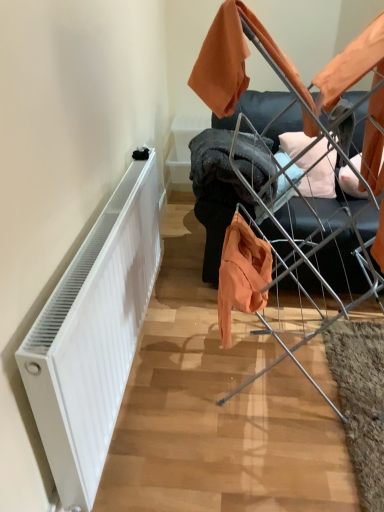
The image size is (384, 512). Identify the location of metallic silver baby carriage at center. (291, 75).

Image resolution: width=384 pixels, height=512 pixels. Identify the location of metal wire drying rack at upper right. (215, 222).

Is metallic silver baby carriage at center beside metal wire drying rack at upper right?

No, metallic silver baby carriage at center is not beside metal wire drying rack at upper right.

Could you tell me if metallic silver baby carriage at center is facing metal wire drying rack at upper right?

Answer: No.

Is metallic silver baby carriage at center inside or outside of metal wire drying rack at upper right?

metallic silver baby carriage at center is outside metal wire drying rack at upper right.

Is point (151, 245) behind point (248, 110)?

No, (151, 245) is closer to viewer.

How far apart are white matte radiator at left and metal wire drying rack at upper right?

A distance of 29.16 inches exists between white matte radiator at left and metal wire drying rack at upper right.

Is white matte radiator at left in contact with metal wire drying rack at upper right?

They are not placed beside each other.

Considering the sizes of objects white matte radiator at left and metal wire drying rack at upper right in the image provided, who is shorter, white matte radiator at left or metal wire drying rack at upper right?

Answer: white matte radiator at left.

Is metallic silver baby carriage at center touching white matte radiator at left?

No, metallic silver baby carriage at center is not with white matte radiator at left.

Is metallic silver baby carriage at center oriented towards white matte radiator at left?

No.

Is point (382, 102) in front of point (151, 182)?

Yes, it is in front of point (151, 182).

From the image's perspective, which is above, metallic silver baby carriage at center or white matte radiator at left?

metallic silver baby carriage at center is shown above in the image.

Based on their positions, is metal wire drying rack at upper right located to the left or right of metallic silver baby carriage at center?

metal wire drying rack at upper right is positioned on metallic silver baby carriage at center's right side.

From a real-world perspective, which is physically above, metal wire drying rack at upper right or metallic silver baby carriage at center?

In real-world perspective, metallic silver baby carriage at center is above.

Considering the positions of objects metal wire drying rack at upper right and metallic silver baby carriage at center in the image provided, who is behind, metal wire drying rack at upper right or metallic silver baby carriage at center?

metal wire drying rack at upper right is more distant.

This screenshot has width=384, height=512. What are the coordinates of `furniture on the right of the white matte radiator at left` in the screenshot? It's located at (215, 222).

Between metal wire drying rack at upper right and white matte radiator at left, which one has more height?

Standing taller between the two is metal wire drying rack at upper right.

Considering the positions of point (231, 190) and point (20, 360), is point (231, 190) closer or farther from the camera than point (20, 360)?

Point (231, 190) appears to be farther away from the viewer than point (20, 360).

From the image's perspective, is metal wire drying rack at upper right located beneath white matte radiator at left?

No, from the image's perspective, metal wire drying rack at upper right is not below white matte radiator at left.

Is white matte radiator at left closer to the viewer compared to metallic silver baby carriage at center?

Yes, white matte radiator at left is closer to the viewer.

From the image's perspective, is white matte radiator at left positioned above or below metallic silver baby carriage at center?

Based on their image positions, white matte radiator at left is located beneath metallic silver baby carriage at center.

Which point is more forward, (94, 287) or (377, 142)?

The point (94, 287) is more forward.

You are a GUI agent. You are given a task and a screenshot of the screen. Output one action in this format:
    pyautogui.click(x=<x>, y=<y>)
    Task: Click on the baby carriage behind the white matte radiator at left
    Image resolution: width=384 pixels, height=512 pixels.
    Given the screenshot: What is the action you would take?
    pyautogui.click(x=291, y=75)

The height and width of the screenshot is (512, 384). Identify the location of baby carriage that appears on the left of metal wire drying rack at upper right. (291, 75).

This screenshot has width=384, height=512. I want to click on radiator below the metal wire drying rack at upper right (from a real-world perspective), so click(93, 336).

Which object lies further to the anchor point metal wire drying rack at upper right, metallic silver baby carriage at center or white matte radiator at left?

Based on the image, white matte radiator at left appears to be further to metal wire drying rack at upper right.

Based on their spatial positions, is metal wire drying rack at upper right or metallic silver baby carriage at center further from white matte radiator at left?

Based on the image, metal wire drying rack at upper right appears to be further to white matte radiator at left.

Looking at the image, which one is located further to metallic silver baby carriage at center, metal wire drying rack at upper right or white matte radiator at left?

Among the two, white matte radiator at left is located further to metallic silver baby carriage at center.

Which object lies nearer to the anchor point metal wire drying rack at upper right, white matte radiator at left or metallic silver baby carriage at center?

metallic silver baby carriage at center is closer to metal wire drying rack at upper right.

Looking at the image, which one is located closer to metallic silver baby carriage at center, white matte radiator at left or metal wire drying rack at upper right?

The object closer to metallic silver baby carriage at center is metal wire drying rack at upper right.

Considering their positions, is metallic silver baby carriage at center positioned further to white matte radiator at left than metal wire drying rack at upper right?

The object further to white matte radiator at left is metal wire drying rack at upper right.

Find the location of a particular element. The image size is (384, 512). baby carriage between white matte radiator at left and metal wire drying rack at upper right along the z-axis is located at coordinates (291, 75).